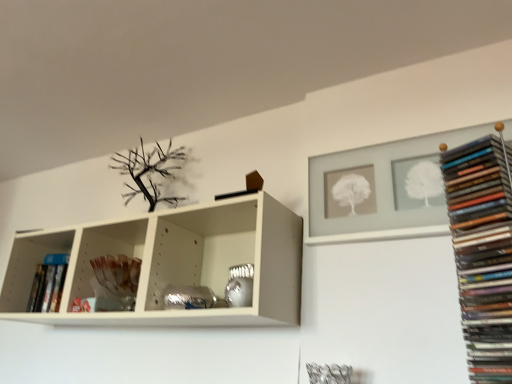
Find the location of a particular element. white matte frame at upper right, the 2th shelf positioned from the bottom is located at coordinates (379, 192).

At what (x,y) coordinates should I click in order to perform the action: click on hardcover book at left, arranged as the first book when viewed from the left. Please return your answer as a coordinate pair (x, y). Image resolution: width=512 pixels, height=384 pixels. Looking at the image, I should click on (48, 283).

From the picture: Considering the sizes of objects white matte frame at upper right, the 1th shelf positioned from the right, and translucent glass vase at center, placed as the 1th shelf when sorted from bottom to top, in the image provided, who is thinner, white matte frame at upper right, the 1th shelf positioned from the right, or translucent glass vase at center, placed as the 1th shelf when sorted from bottom to top,?

white matte frame at upper right, the 1th shelf positioned from the right.

I want to click on shelf below the white matte frame at upper right, the 2th shelf positioned from the bottom (from a real-world perspective), so click(x=108, y=267).

Which point is more distant from viewer, [449,132] or [88,290]?

Point [88,290]

Which is more to the left, translucent glass vase at center, positioned as the first shelf in left-to-right order, or hardcover book at left, which appears as the second book when viewed from the right?

From the viewer's perspective, hardcover book at left, which appears as the second book when viewed from the right, appears more on the left side.

From the picture: From a real-world perspective, is translucent glass vase at center, placed as the 1th shelf when sorted from bottom to top, over hardcover book at left, the 2th book positioned from the front?

No, from a real-world perspective, translucent glass vase at center, placed as the 1th shelf when sorted from bottom to top, is not above hardcover book at left, the 2th book positioned from the front.

Consider the image. Considering the relative sizes of translucent glass vase at center, placed as the 1th shelf when sorted from bottom to top, and hardcover book at left, the 2th book positioned from the front, in the image provided, is translucent glass vase at center, placed as the 1th shelf when sorted from bottom to top, thinner than hardcover book at left, the 2th book positioned from the front,?

No.

From the image's perspective, who appears lower, translucent glass vase at center, which ranks as the 2th shelf in top-to-bottom order, or hardcover book at left, the 2th book positioned from the front?

hardcover book at left, the 2th book positioned from the front.

Between matte black books at right, the 2th book in the left-to-right sequence, and hardcover book at left, arranged as the first book when viewed from the left, which one has more height?

matte black books at right, the 2th book in the left-to-right sequence, is taller.

From a real-world perspective, is matte black books at right, positioned as the 1th book in front-to-back order, positioned above or below hardcover book at left, the 2th book positioned from the front?

From a real-world perspective, matte black books at right, positioned as the 1th book in front-to-back order, is physically above hardcover book at left, the 2th book positioned from the front.

Is matte black books at right, which is the second book in back-to-front order, facing away from hardcover book at left, which appears as the second book when viewed from the right?

matte black books at right, which is the second book in back-to-front order, is not turned away from hardcover book at left, which appears as the second book when viewed from the right.

Is matte black books at right, the 2th book in the left-to-right sequence, next to hardcover book at left, the 2th book positioned from the front, and touching it?

matte black books at right, the 2th book in the left-to-right sequence, and hardcover book at left, the 2th book positioned from the front, are not in contact.

Is hardcover book at left, the 2th book positioned from the front, positioned before white matte frame at upper right, placed as the first shelf when sorted from top to bottom?

No.

Considering the sizes of objects hardcover book at left, which appears as the second book when viewed from the right, and white matte frame at upper right, placed as the first shelf when sorted from top to bottom, in the image provided, who is shorter, hardcover book at left, which appears as the second book when viewed from the right, or white matte frame at upper right, placed as the first shelf when sorted from top to bottom,?

Standing shorter between the two is hardcover book at left, which appears as the second book when viewed from the right.

Looking at this image, could you tell me if hardcover book at left, which ranks as the first book in back-to-front order, is turned towards white matte frame at upper right, the 2th shelf positioned from the bottom?

No.

From the image's perspective, which one is positioned lower, matte black books at right, which is the second book in back-to-front order, or white matte frame at upper right, the 1th shelf positioned from the right?

From the image's view, matte black books at right, which is the second book in back-to-front order, is below.

Is white matte frame at upper right, the 2th shelf positioned from the bottom, surrounded by matte black books at right, the 2th book in the left-to-right sequence?

Actually, white matte frame at upper right, the 2th shelf positioned from the bottom, is outside matte black books at right, the 2th book in the left-to-right sequence.

Is matte black books at right, which is the second book in back-to-front order, oriented towards white matte frame at upper right, which is the 2th shelf from left to right?

No, matte black books at right, which is the second book in back-to-front order, is not oriented towards white matte frame at upper right, which is the 2th shelf from left to right.

Can we say translucent glass vase at center, positioned as the first shelf in left-to-right order, lies outside matte black books at right, the 2th book in the left-to-right sequence?

translucent glass vase at center, positioned as the first shelf in left-to-right order, is positioned outside matte black books at right, the 2th book in the left-to-right sequence.

You are a GUI agent. You are given a task and a screenshot of the screen. Output one action in this format:
    pyautogui.click(x=<x>, y=<y>)
    Task: Click on the book lying in front of the translucent glass vase at center, positioned as the first shelf in left-to-right order
    
    Given the screenshot: What is the action you would take?
    pyautogui.click(x=483, y=251)

Could you tell me if translucent glass vase at center, the 2th shelf from the right, is facing matte black books at right, the 2th book in the left-to-right sequence?

No, translucent glass vase at center, the 2th shelf from the right, is not turned towards matte black books at right, the 2th book in the left-to-right sequence.

From the image's perspective, would you say white matte frame at upper right, the 2th shelf positioned from the bottom, is shown under hardcover book at left, arranged as the first book when viewed from the left?

Actually, white matte frame at upper right, the 2th shelf positioned from the bottom, appears above hardcover book at left, arranged as the first book when viewed from the left, in the image.

Is white matte frame at upper right, the 1th shelf positioned from the right, oriented towards hardcover book at left, which appears as the second book when viewed from the right?

No, white matte frame at upper right, the 1th shelf positioned from the right, does not turn towards hardcover book at left, which appears as the second book when viewed from the right.

From a real-world perspective, who is located higher, white matte frame at upper right, placed as the first shelf when sorted from top to bottom, or hardcover book at left, which appears as the second book when viewed from the right?

white matte frame at upper right, placed as the first shelf when sorted from top to bottom.

Where is `shelf in front of the translucent glass vase at center, positioned as the first shelf in left-to-right order`? The height and width of the screenshot is (384, 512). shelf in front of the translucent glass vase at center, positioned as the first shelf in left-to-right order is located at coordinates (379, 192).

There is a translucent glass vase at center, the 2th shelf from the right. In order to click on the 1st book above it (from a real-world perspective) in this screenshot , I will do `click(48, 283)`.

Looking at the image, which one is located closer to hardcover book at left, which ranks as the first book in back-to-front order, translucent glass vase at center, positioned as the first shelf in left-to-right order, or matte black books at right, which is the second book in back-to-front order?

Based on the image, translucent glass vase at center, positioned as the first shelf in left-to-right order, appears to be nearer to hardcover book at left, which ranks as the first book in back-to-front order.

From the image, which object appears to be nearer to matte black books at right, the 2th book in the left-to-right sequence, translucent glass vase at center, positioned as the first shelf in left-to-right order, or hardcover book at left, the 2th book positioned from the front?

translucent glass vase at center, positioned as the first shelf in left-to-right order, is closer to matte black books at right, the 2th book in the left-to-right sequence.

Estimate the real-world distances between objects in this image. Which object is closer to matte black books at right, the 2th book in the left-to-right sequence, hardcover book at left, the 2th book positioned from the front, or translucent glass vase at center, the 2th shelf from the right?

translucent glass vase at center, the 2th shelf from the right, is closer to matte black books at right, the 2th book in the left-to-right sequence.

Which object lies nearer to the anchor point matte black books at right, which is the second book in back-to-front order, hardcover book at left, which appears as the second book when viewed from the right, or white matte frame at upper right, the 2th shelf positioned from the bottom?

white matte frame at upper right, the 2th shelf positioned from the bottom, lies closer to matte black books at right, which is the second book in back-to-front order, than the other object.

In the scene shown: Looking at the image, which one is located further to matte black books at right, which is the second book in back-to-front order, white matte frame at upper right, placed as the first shelf when sorted from top to bottom, or hardcover book at left, the 2th book positioned from the front?

hardcover book at left, the 2th book positioned from the front, lies further to matte black books at right, which is the second book in back-to-front order, than the other object.

Based on their spatial positions, is matte black books at right, which is the second book in back-to-front order, or hardcover book at left, the 2th book positioned from the front, closer to white matte frame at upper right, placed as the first shelf when sorted from top to bottom?

matte black books at right, which is the second book in back-to-front order, is closer to white matte frame at upper right, placed as the first shelf when sorted from top to bottom.

Estimate the real-world distances between objects in this image. Which object is further from translucent glass vase at center, positioned as the first shelf in left-to-right order, white matte frame at upper right, which is the 2th shelf from left to right, or matte black books at right, which is the second book in back-to-front order?

matte black books at right, which is the second book in back-to-front order, is further to translucent glass vase at center, positioned as the first shelf in left-to-right order.

Which object lies nearer to the anchor point translucent glass vase at center, positioned as the first shelf in left-to-right order, hardcover book at left, arranged as the first book when viewed from the left, or white matte frame at upper right, the 1th shelf positioned from the right?

Based on the image, hardcover book at left, arranged as the first book when viewed from the left, appears to be nearer to translucent glass vase at center, positioned as the first shelf in left-to-right order.

Locate an element on the screen. The image size is (512, 384). shelf situated between translucent glass vase at center, which ranks as the 2th shelf in top-to-bottom order, and matte black books at right, the 2th book in the left-to-right sequence, from left to right is located at coordinates (379, 192).

The height and width of the screenshot is (384, 512). I want to click on shelf between hardcover book at left, which ranks as the first book in back-to-front order, and white matte frame at upper right, which is the 2th shelf from left to right, so 108,267.